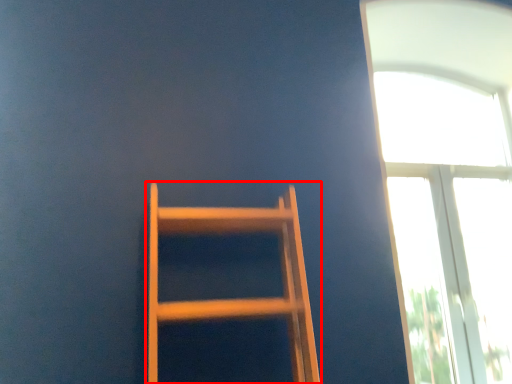
Question: From the image's perspective, what is the correct spatial relationship of furniture (annotated by the red box) in relation to window?

Choices:
 (A) above
 (B) below

Answer: (B)